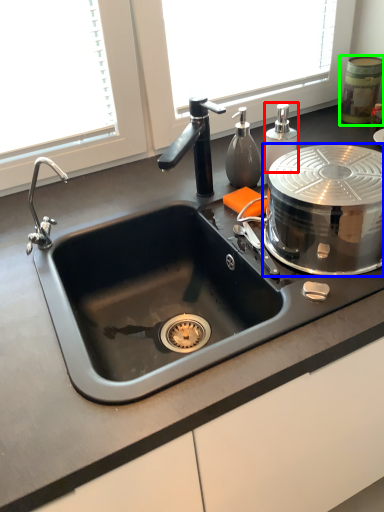
Question: Considering the real-world distances, which object is closest to soap dispenser (highlighted by a red box)? appliance (highlighted by a blue box) or appliance (highlighted by a green box).

Choices:
 (A) appliance
 (B) appliance

Answer: (A)